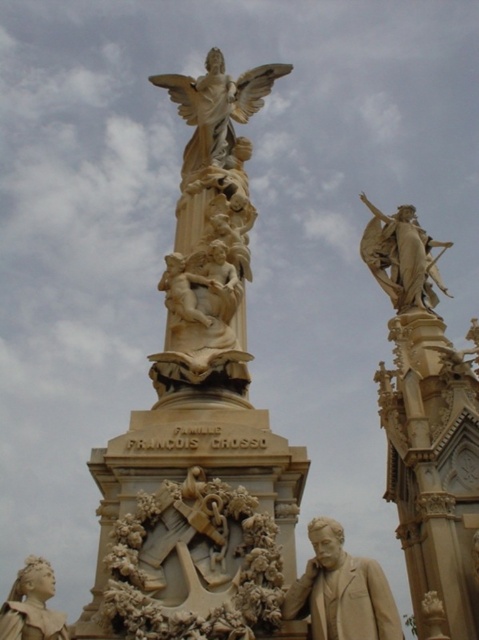
Question: Which point is closer to the camera?

Choices:
 (A) (431, 506)
 (B) (44, 632)

Answer: (B)

Question: Does matte gold statue at upper right appear on the left side of beige marble statue at center?

Choices:
 (A) no
 (B) yes

Answer: (A)

Question: Does beige marble statue at center have a lesser width compared to golden polished statue at upper right?

Choices:
 (A) no
 (B) yes

Answer: (A)

Question: Which point is closer to the camera taking this photo?

Choices:
 (A) (235, 269)
 (B) (409, 452)

Answer: (A)

Question: Does beige marble statue at center appear under beige stone statue at lower center?

Choices:
 (A) yes
 (B) no

Answer: (B)

Question: Among these objects, which one is nearest to the camera?

Choices:
 (A) matte gold statue at lower left
 (B) matte gold statue at upper right
 (C) beige marble statue at center

Answer: (A)